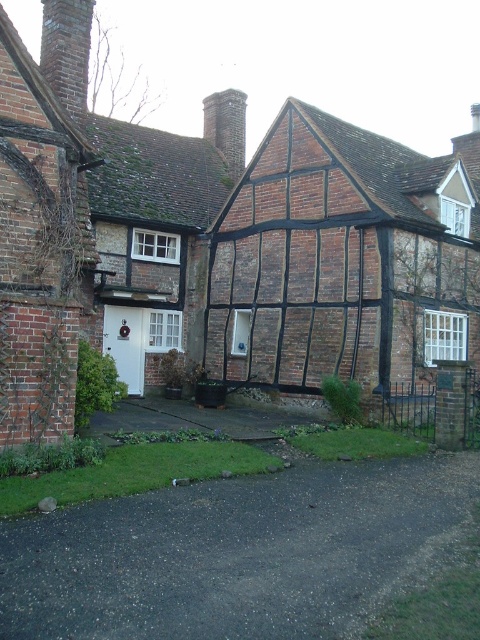
Which is more to the left, dark asphalt driveway at lower center or brick chimney at upper left?

brick chimney at upper left

Describe the element at coordinates (238, 554) in the screenshot. The width and height of the screenshot is (480, 640). I see `dark asphalt driveway at lower center` at that location.

Identify the location of dark asphalt driveway at lower center. The width and height of the screenshot is (480, 640). (238, 554).

I want to click on dark gray asphalt driveway at lower center, so click(x=203, y=417).

Can you confirm if dark gray asphalt driveway at lower center is shorter than brick chimney at upper left?

Correct, dark gray asphalt driveway at lower center is not as tall as brick chimney at upper left.

Who is more forward, (95,420) or (66,29)?

Point (95,420)

You are a GUI agent. You are given a task and a screenshot of the screen. Output one action in this format:
    pyautogui.click(x=<x>, y=<y>)
    Task: Click on the dark gray asphalt driveway at lower center
    
    Given the screenshot: What is the action you would take?
    pyautogui.click(x=203, y=417)

Between point (176, 424) and point (225, 161), which one is positioned behind?

The point (225, 161) is behind.

Between dark gray asphalt driveway at lower center and brown brick chimney at upper center, which one has less height?

dark gray asphalt driveway at lower center is shorter.

Who is more distant from viewer, [245,420] or [226,92]?

Point [226,92]

In order to click on dark gray asphalt driveway at lower center in this screenshot , I will do `click(203, 417)`.